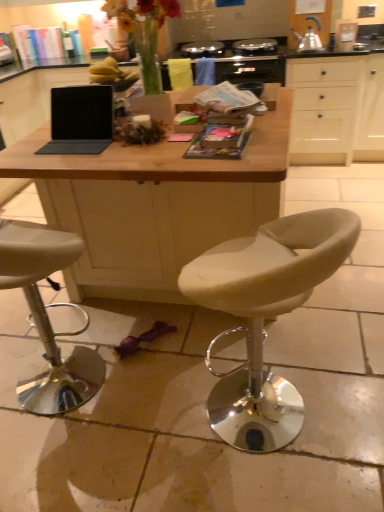
This screenshot has width=384, height=512. Describe the element at coordinates (230, 100) in the screenshot. I see `printed paper magazine at center, which is counted as the 1th magazine, starting from the top` at that location.

Find the location of a particular element. The image size is (384, 512). translucent glass vase at upper center is located at coordinates (144, 32).

At what (x,y) coordinates should I click in order to perform the action: click on wooden desk at center. Please return your answer as a coordinate pair (x, y). The width and height of the screenshot is (384, 512). Looking at the image, I should click on (154, 204).

This screenshot has width=384, height=512. Describe the element at coordinates (154, 204) in the screenshot. I see `wooden desk at center` at that location.

Locate an element on the screen. matte paper magazine at center, which is counted as the 1th magazine, starting from the bottom is located at coordinates (215, 149).

In order to face white leather stool at center, which is the second chair in left-to-right order, should I rotate leftwards or rightwards?

A 9.367 degree turn to the right will do.

The width and height of the screenshot is (384, 512). I want to click on black glass gas stove at upper center, so click(x=243, y=63).

Is matte black laptop at center facing away from matte paper magazine at center, the second magazine from the top?

No, matte black laptop at center is not facing away from matte paper magazine at center, the second magazine from the top.

In the image, is matte black laptop at center positioned in front of or behind matte paper magazine at center, which is counted as the 1th magazine, starting from the bottom?

Visually, matte black laptop at center is located behind matte paper magazine at center, which is counted as the 1th magazine, starting from the bottom.

From a real-world perspective, is matte black laptop at center positioned under matte paper magazine at center, which is counted as the 1th magazine, starting from the front, based on gravity?

No, from a real-world perspective, matte black laptop at center is not under matte paper magazine at center, which is counted as the 1th magazine, starting from the front.

Is matte black laptop at center situated inside matte paper magazine at center, which is counted as the 1th magazine, starting from the bottom, or outside?

matte black laptop at center is located beyond the bounds of matte paper magazine at center, which is counted as the 1th magazine, starting from the bottom.

Based on the photo, who is taller, translucent glass vase at upper center or beige leather stool at lower left, which ranks as the second chair in right-to-left order?

With more height is beige leather stool at lower left, which ranks as the second chair in right-to-left order.

Is translucent glass vase at upper center further to camera compared to beige leather stool at lower left, the first chair from the left?

Yes, it is behind beige leather stool at lower left, the first chair from the left.

From a real-world perspective, who is located higher, translucent glass vase at upper center or beige leather stool at lower left, the first chair from the left?

translucent glass vase at upper center.

Considering the positions of points (147, 37) and (100, 360), is point (147, 37) farther from camera compared to point (100, 360)?

Yes.

From a real-world perspective, who is located lower, printed paper magazine at center, which is counted as the 1th magazine, starting from the top, or white matte cabinet at upper right?

white matte cabinet at upper right.

Is printed paper magazine at center, which is counted as the 1th magazine, starting from the top, thinner than white matte cabinet at upper right?

Yes, printed paper magazine at center, which is counted as the 1th magazine, starting from the top, is thinner than white matte cabinet at upper right.

Is point (226, 93) less distant than point (349, 159)?

Yes.

Is the surface of printed paper magazine at center, the 2th magazine from the front, in direct contact with white matte cabinet at upper right?

No, printed paper magazine at center, the 2th magazine from the front, is not next to white matte cabinet at upper right.

From a real-world perspective, which is physically above, beige leather stool at lower left, the first chair from the left, or white matte cabinet at upper right?

white matte cabinet at upper right is physically above.

Is the surface of beige leather stool at lower left, which ranks as the second chair in right-to-left order, in direct contact with white matte cabinet at upper right?

There is a gap between beige leather stool at lower left, which ranks as the second chair in right-to-left order, and white matte cabinet at upper right.

Is beige leather stool at lower left, the first chair from the left, inside the boundaries of white matte cabinet at upper right, or outside?

beige leather stool at lower left, the first chair from the left, exists outside the volume of white matte cabinet at upper right.

How far apart are beige leather stool at lower left, which ranks as the second chair in right-to-left order, and white matte cabinet at upper right?

beige leather stool at lower left, which ranks as the second chair in right-to-left order, and white matte cabinet at upper right are 8.38 feet apart.

Is white matte cabinet at upper right at the back of white leather stool at center, the 1th chair positioned from the right?

white leather stool at center, the 1th chair positioned from the right, is not turned away from white matte cabinet at upper right.

Can you tell me how much white leather stool at center, which is the second chair in left-to-right order, and white matte cabinet at upper right differ in facing direction?

The facing directions of white leather stool at center, which is the second chair in left-to-right order, and white matte cabinet at upper right are 121 degrees apart.

Which object is further away from the camera taking this photo, white leather stool at center, the 1th chair positioned from the right, or white matte cabinet at upper right?

Positioned behind is white matte cabinet at upper right.

In terms of width, does white leather stool at center, which is the second chair in left-to-right order, look wider or thinner when compared to white matte cabinet at upper right?

white leather stool at center, which is the second chair in left-to-right order, is thinner than white matte cabinet at upper right.

Is printed paper magazine at center, the 2th magazine from the front, looking in the opposite direction of white leather stool at center, the 1th chair positioned from the right?

No, printed paper magazine at center, the 2th magazine from the front, is not facing away from white leather stool at center, the 1th chair positioned from the right.

From the image's perspective, who appears lower, printed paper magazine at center, which is counted as the 1th magazine, starting from the top, or white leather stool at center, the 1th chair positioned from the right?

white leather stool at center, the 1th chair positioned from the right, appears lower in the image.

From a real-world perspective, is printed paper magazine at center, the second magazine when ordered from bottom to top, above or below white leather stool at center, the 1th chair positioned from the right?

printed paper magazine at center, the second magazine when ordered from bottom to top, is above white leather stool at center, the 1th chair positioned from the right.

Is printed paper magazine at center, the second magazine when ordered from bottom to top, shorter than white leather stool at center, the 1th chair positioned from the right?

Yes, printed paper magazine at center, the second magazine when ordered from bottom to top, is shorter than white leather stool at center, the 1th chair positioned from the right.

Find the location of a particular element. This screenshot has width=384, height=512. floral arrangement above the white leather stool at center, the 1th chair positioned from the right (from the image's perspective) is located at coordinates (144, 32).

Is white leather stool at center, the 1th chair positioned from the right, facing towards translucent glass vase at upper center?

Yes.

From the picture: Does white leather stool at center, which is the second chair in left-to-right order, have a greater width compared to translucent glass vase at upper center?

Indeed, white leather stool at center, which is the second chair in left-to-right order, has a greater width compared to translucent glass vase at upper center.

Considering the relative positions of white leather stool at center, the 1th chair positioned from the right, and translucent glass vase at upper center in the image provided, is white leather stool at center, the 1th chair positioned from the right, in front of translucent glass vase at upper center?

Yes, the depth of white leather stool at center, the 1th chair positioned from the right, is less than that of translucent glass vase at upper center.

Image resolution: width=384 pixels, height=512 pixels. What are the coordinates of `laptop that is above the matte paper magazine at center, which is counted as the 1th magazine, starting from the bottom (from a real-world perspective)` in the screenshot? It's located at (80, 120).

Where is `floral arrangement above the beige leather stool at lower left, the first chair from the left (from the image's perspective)`? This screenshot has height=512, width=384. floral arrangement above the beige leather stool at lower left, the first chair from the left (from the image's perspective) is located at coordinates point(144,32).

Looking at the image, which one is located closer to matte black laptop at center, beige leather stool at lower left, which ranks as the second chair in right-to-left order, or white leather stool at center, the 1th chair positioned from the right?

beige leather stool at lower left, which ranks as the second chair in right-to-left order.

When comparing their distances from matte paper magazine at center, the second magazine from the top, does translucent glass vase at upper center or printed paper magazine at center, the second magazine when ordered from bottom to top, seem further?

Among the two, translucent glass vase at upper center is located further to matte paper magazine at center, the second magazine from the top.

Consider the image. Which object lies further to the anchor point matte black laptop at center, black glass gas stove at upper center or white matte cabinet at upper right?

white matte cabinet at upper right is further to matte black laptop at center.

Based on their spatial positions, is white matte cabinet at upper right or black glass gas stove at upper center further from matte black laptop at center?

white matte cabinet at upper right.

Which object lies nearer to the anchor point printed paper magazine at center, the first magazine from the back, matte paper magazine at center, which appears as the 2th magazine when viewed from the back, or beige leather stool at lower left, which ranks as the second chair in right-to-left order?

matte paper magazine at center, which appears as the 2th magazine when viewed from the back, is positioned closer to the anchor printed paper magazine at center, the first magazine from the back.

Looking at this image, considering their positions, is beige leather stool at lower left, which ranks as the second chair in right-to-left order, positioned further to wooden desk at center than matte black laptop at center?

beige leather stool at lower left, which ranks as the second chair in right-to-left order, is further to wooden desk at center.

Which object lies further to the anchor point beige leather stool at lower left, which ranks as the second chair in right-to-left order, wooden desk at center or matte black laptop at center?

The object further to beige leather stool at lower left, which ranks as the second chair in right-to-left order, is matte black laptop at center.

Estimate the real-world distances between objects in this image. Which object is closer to printed paper magazine at center, the first magazine from the back, wooden desk at center or beige leather stool at lower left, the first chair from the left?

wooden desk at center is positioned closer to the anchor printed paper magazine at center, the first magazine from the back.

I want to click on cabinetry between matte paper magazine at center, which is counted as the 1th magazine, starting from the bottom, and black glass gas stove at upper center in the front-back direction, so click(337, 109).

Identify the location of desk between white leather stool at center, the 1th chair positioned from the right, and black glass gas stove at upper center in the front-back direction. (154, 204).

I want to click on magazine between translucent glass vase at upper center and black glass gas stove at upper center from front to back, so click(230, 100).

Where is `floral arrangement located between white leather stool at center, which is the second chair in left-to-right order, and black glass gas stove at upper center in the depth direction`? The height and width of the screenshot is (512, 384). floral arrangement located between white leather stool at center, which is the second chair in left-to-right order, and black glass gas stove at upper center in the depth direction is located at coordinates (144, 32).